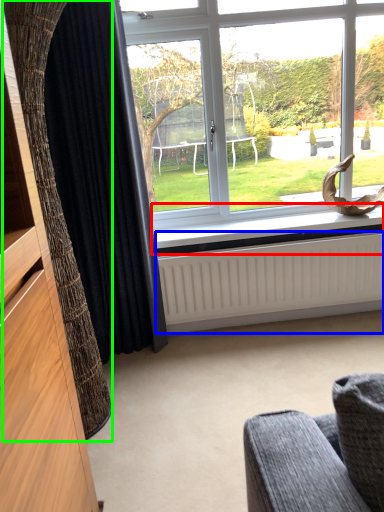
Question: Which object is positioned closest to window sill (highlighted by a red box)? Select from radiator (highlighted by a blue box) and curtain (highlighted by a green box).

Choices:
 (A) radiator
 (B) curtain

Answer: (A)